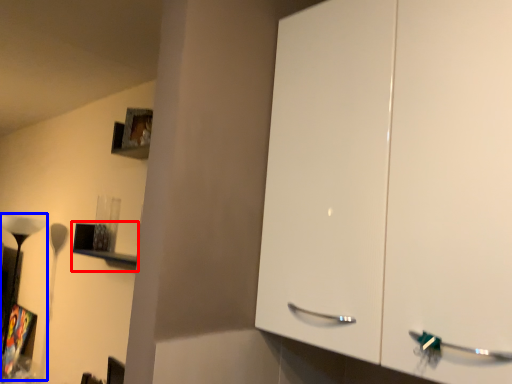
Question: Among these objects, which one is farthest to the camera, shelf (highlighted by a red box) or lamp (highlighted by a blue box)?

Choices:
 (A) shelf
 (B) lamp

Answer: (B)